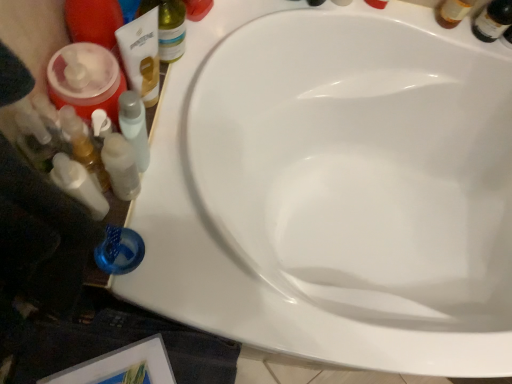
Question: Is translucent plastic bottle at upper left far from translucent glass beer bottle at upper right?

Choices:
 (A) yes
 (B) no

Answer: (B)

Question: Is translucent plastic bottle at upper left turned away from translucent glass beer bottle at upper right?

Choices:
 (A) yes
 (B) no

Answer: (B)

Question: From a real-world perspective, does translucent plastic bottle at upper left sit lower than translucent glass beer bottle at upper right?

Choices:
 (A) no
 (B) yes

Answer: (A)

Question: Is the depth of translucent plastic bottle at upper left greater than that of translucent glass beer bottle at upper right?

Choices:
 (A) no
 (B) yes

Answer: (A)

Question: Does translucent plastic bottle at upper left have a greater width compared to translucent glass beer bottle at upper right?

Choices:
 (A) yes
 (B) no

Answer: (A)

Question: Considering the relative positions of translucent plastic bottle at upper left and translucent glass beer bottle at upper right in the image provided, is translucent plastic bottle at upper left to the left of translucent glass beer bottle at upper right from the viewer's perspective?

Choices:
 (A) yes
 (B) no

Answer: (A)

Question: Does white plastic bottles at left appear on the left side of translucent glass beer bottle at upper right?

Choices:
 (A) no
 (B) yes

Answer: (B)

Question: Would you say white plastic bottles at left is outside translucent glass beer bottle at upper right?

Choices:
 (A) no
 (B) yes

Answer: (B)

Question: From the image's perspective, is white plastic bottles at left over translucent glass beer bottle at upper right?

Choices:
 (A) no
 (B) yes

Answer: (A)

Question: Does white plastic bottles at left have a greater height compared to translucent glass beer bottle at upper right?

Choices:
 (A) no
 (B) yes

Answer: (B)

Question: From a real-world perspective, is white plastic bottles at left on translucent glass beer bottle at upper right?

Choices:
 (A) yes
 (B) no

Answer: (A)

Question: From the image's perspective, is white plastic bottles at left under translucent glass beer bottle at upper right?

Choices:
 (A) no
 (B) yes

Answer: (B)

Question: Is white plastic bottles at left looking in the opposite direction of translucent plastic bottle at upper left?

Choices:
 (A) no
 (B) yes

Answer: (A)